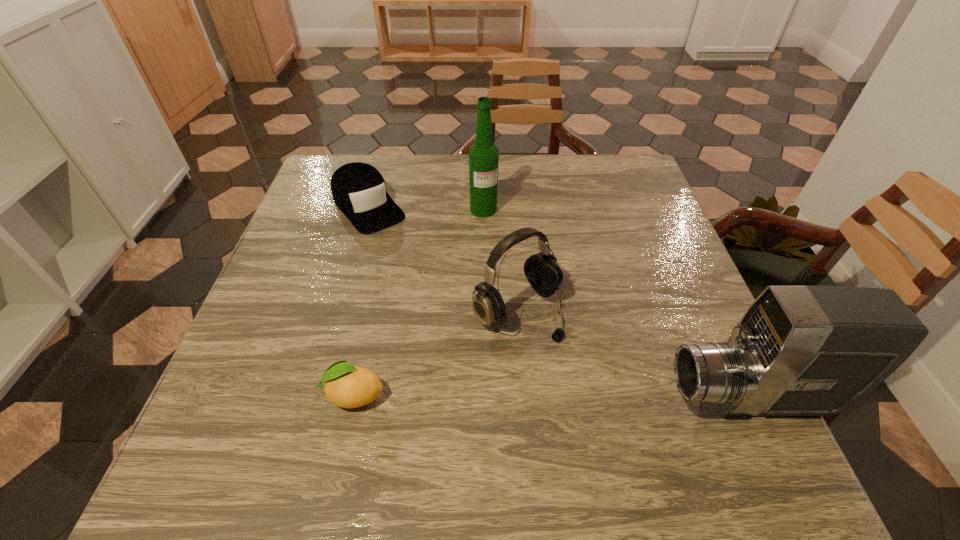
Locate an element on the screen. vacant space on the desktop that is between the shortest object and the rightmost object and is positioned on the label of the beer bottle is located at coordinates (581, 397).

You are a GUI agent. You are given a task and a screenshot of the screen. Output one action in this format:
    pyautogui.click(x=<x>, y=<y>)
    Task: Click on the free space on the desktop that is between the lemon and the rightmost object and is positioned on the front-facing side of the cap
    The image size is (960, 540).
    Given the screenshot: What is the action you would take?
    pyautogui.click(x=534, y=396)

The image size is (960, 540). I want to click on free space on the desktop that is between the shortest object and the fourth shortest object and is positioned with the microphone on the side of the headset, so click(x=605, y=397).